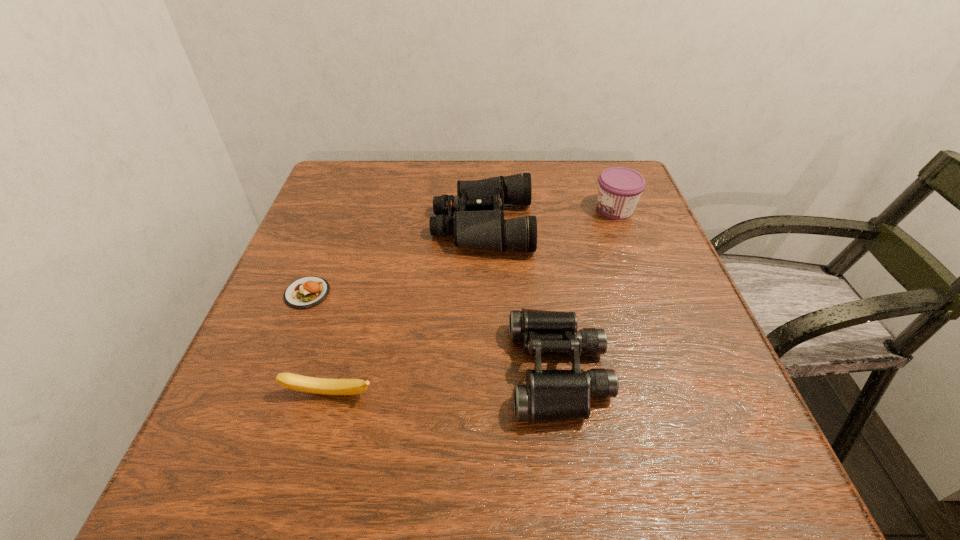
Locate an element on the screen. This screenshot has width=960, height=540. jam is located at coordinates click(619, 190).

Locate an element on the screen. This screenshot has width=960, height=540. the farther binoculars is located at coordinates (478, 222).

This screenshot has height=540, width=960. In order to click on the nearer binoculars in this screenshot , I will do `click(549, 395)`.

I want to click on banana, so click(x=325, y=386).

The image size is (960, 540). I want to click on the shortest object, so click(x=306, y=292).

The height and width of the screenshot is (540, 960). I want to click on the third nearest object, so click(x=306, y=292).

Identify the location of vacant space located on the front label of the jam. The height and width of the screenshot is (540, 960). (564, 209).

Where is `vacant space located on the front label of the jam`? This screenshot has width=960, height=540. vacant space located on the front label of the jam is located at coordinates (536, 209).

The image size is (960, 540). In order to click on blank space located 0.160m on the front label of the jam in this screenshot , I will do `click(527, 209)`.

The width and height of the screenshot is (960, 540). What are the coordinates of `vacant space located 0.250m through the eyepieces of the farther binoculars` in the screenshot? It's located at (325, 225).